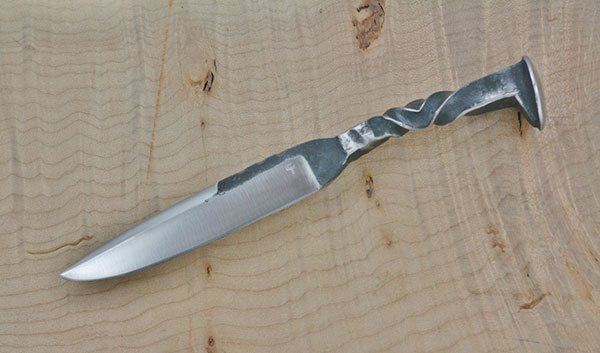
Where is `table`? table is located at coordinates (223, 79).